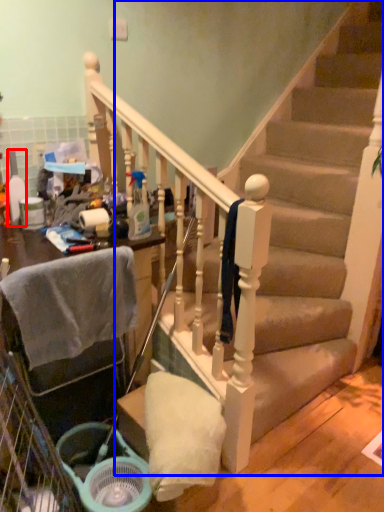
Question: Which point is further to the camera, bottle (highlighted by a red box) or stairs (highlighted by a blue box)?

Choices:
 (A) bottle
 (B) stairs

Answer: (A)